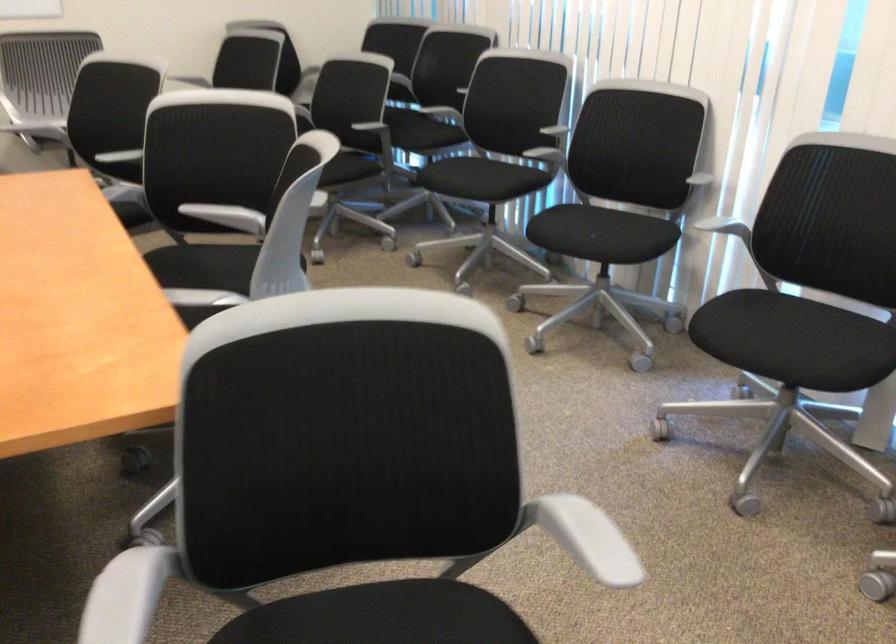
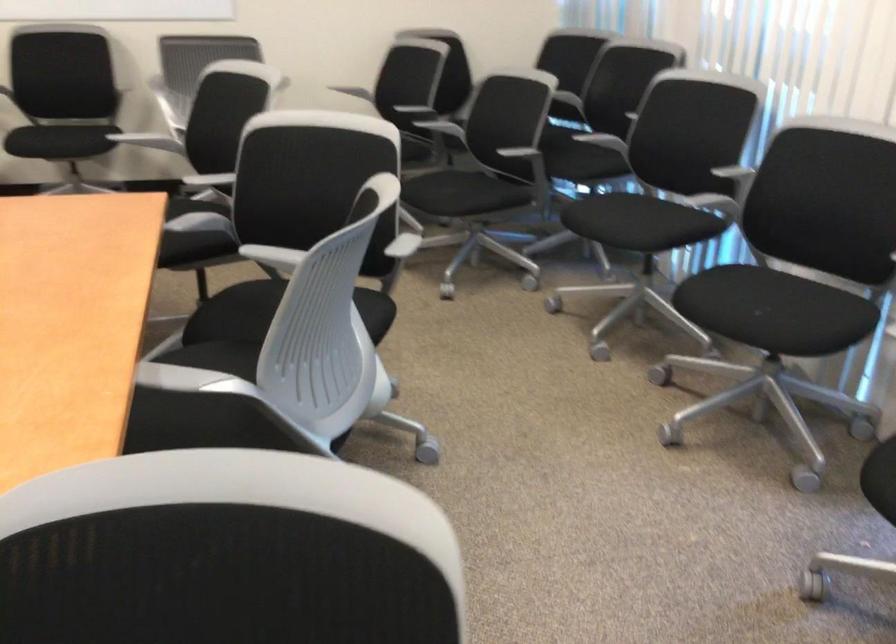
Locate, in the second image, the point that corresponds to (x=605, y=234) in the first image.

(771, 310)